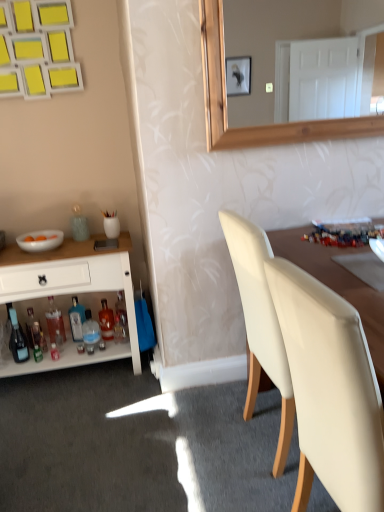
Question: In terms of height, does white matte chair at right look taller or shorter compared to translucent glass bottle at lower left, positioned as the 7th bottle in left-to-right order?

Choices:
 (A) tall
 (B) short

Answer: (A)

Question: From the image's perspective, is white matte chair at right above or below translucent glass bottle at lower left, positioned as the 7th bottle in left-to-right order?

Choices:
 (A) above
 (B) below

Answer: (B)

Question: Which object is the farthest from the translucent glass bottle at lower left, the 6th bottle positioned from the left?

Choices:
 (A) translucent glass bottle at lower left, positioned as the 5th bottle in right-to-left order
 (B) shiny glass bottle at lower left, the first bottle when ordered from left to right
 (C) translucent glass bottle at lower left, which is the 5th bottle from left to right
 (D) white matte chair at right
 (E) translucent glass bottle at lower left, which is the 1th bottle from right to left

Answer: (D)

Question: Which is farther from the shiny glass bottle at lower left, the first bottle when ordered from left to right?

Choices:
 (A) translucent glass bottle at lower left, which is counted as the third bottle, starting from the right
 (B) white glossy cabinet at left
 (C) white glossy bowl at left
 (D) translucent glass bottle at lower left, placed as the second bottle when sorted from right to left
 (E) translucent glass bottle at lower left, positioned as the 7th bottle in left-to-right order

Answer: (E)